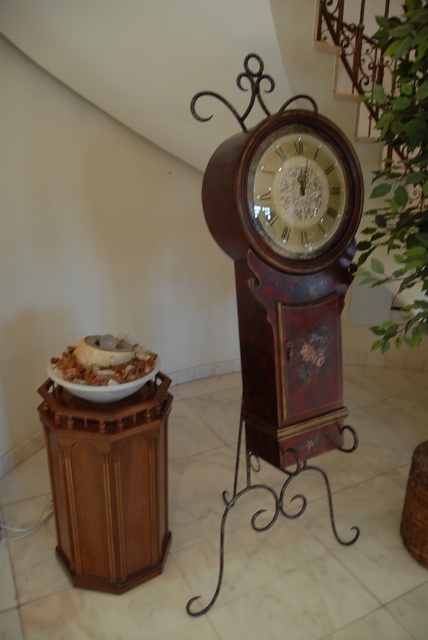
Can you confirm if wooden clock at center is positioned to the right of white matte plate at left?

Yes, wooden clock at center is to the right of white matte plate at left.

Find the location of a particular element. wooden clock at center is located at coordinates (299, 193).

This screenshot has width=428, height=640. Describe the element at coordinates (299, 193) in the screenshot. I see `wooden clock at center` at that location.

Does point (285, 150) come behind point (125, 380)?

No, (285, 150) is closer to viewer.

Who is more forward, (314,138) or (95,340)?

Point (314,138)

At what (x,y) coordinates should I click in order to perform the action: click on wooden clock at center. Please return your answer as a coordinate pair (x, y). This screenshot has width=428, height=640. Looking at the image, I should click on (299, 193).

Is point (83, 342) closer to camera compared to point (124, 388)?

That is False.

Which is behind, point (98, 384) or point (143, 376)?

The point (143, 376) is behind.

Find the location of a particular element. shiny brown bowl at lower left is located at coordinates (104, 362).